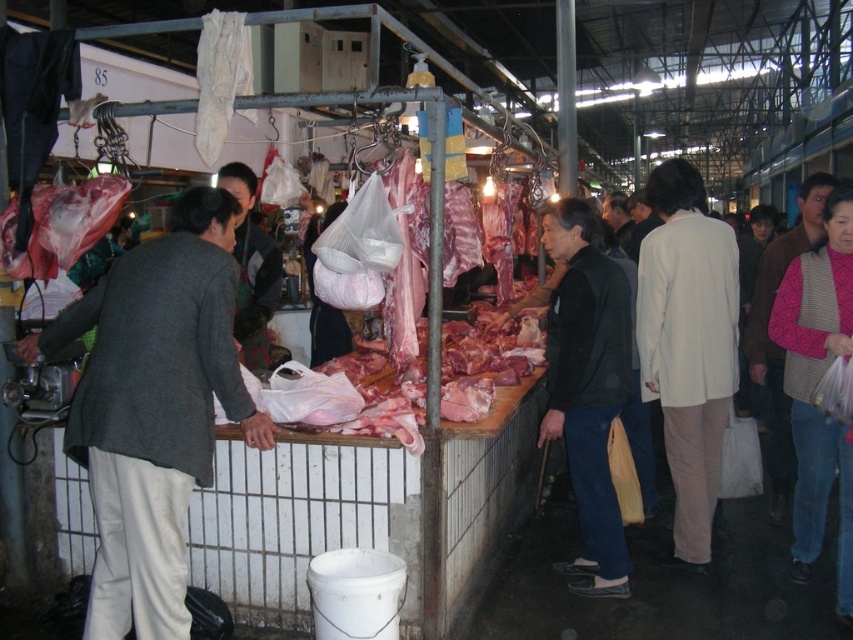
Who is higher up, white matte jacket at right or pink knitted sweater at right?

Positioned higher is white matte jacket at right.

Between white matte jacket at right and pink knitted sweater at right, which one is positioned lower?

pink knitted sweater at right is below.

You are a GUI agent. You are given a task and a screenshot of the screen. Output one action in this format:
    pyautogui.click(x=<x>, y=<y>)
    Task: Click on the white matte jacket at right
    The width and height of the screenshot is (853, 640).
    Given the screenshot: What is the action you would take?
    pyautogui.click(x=688, y=344)

You are a GUI agent. You are given a task and a screenshot of the screen. Output one action in this format:
    pyautogui.click(x=<x>, y=<y>)
    Task: Click on the white matte jacket at right
    The image size is (853, 640).
    Given the screenshot: What is the action you would take?
    point(688,344)

Is point (824, 180) positioned behind point (245, 272)?

Yes, point (824, 180) is behind point (245, 272).

From the picture: Is pink knitted sweater at right taller than dark gray sweater at center?

Yes.

Measure the distance between point (764, 385) and camera.

5.69 meters

Where is `pink knitted sweater at right`? The width and height of the screenshot is (853, 640). pink knitted sweater at right is located at coordinates (770, 339).

Which is in front, point (659, 189) or point (267, 268)?

Point (659, 189) is more forward.

This screenshot has width=853, height=640. I want to click on white matte jacket at right, so click(688, 344).

Locate an element on the screen. This screenshot has width=853, height=640. white matte jacket at right is located at coordinates pos(688,344).